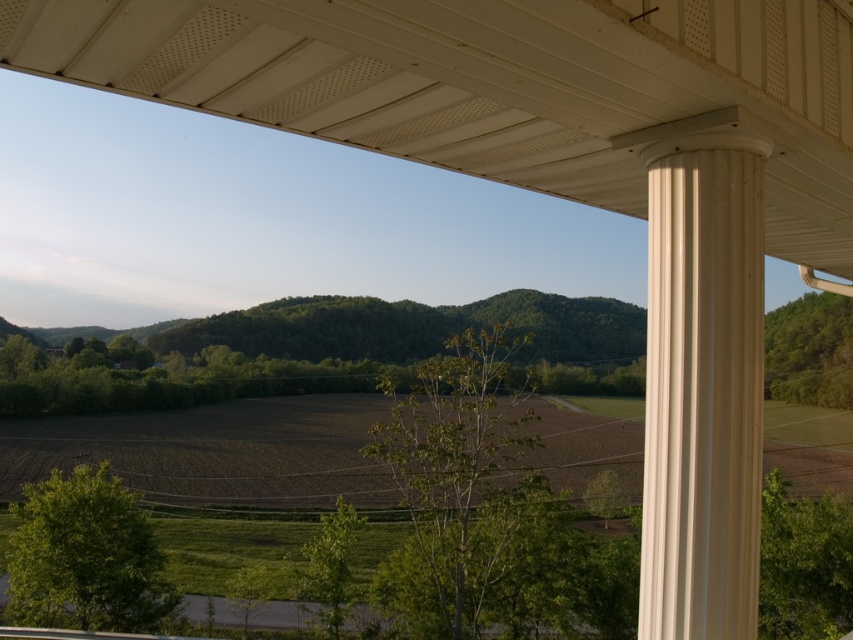
Imagine you are standing on the porch and looking out into the landscape. There are two points marked in the scene. The first point is at coordinates point (399, 134) and the second is at point (688, 580). Which point is closer to you?

Point (399, 134) is further to the camera than point (688, 580), so the point closer to you is point (688, 580).

You are standing under the porch and want to compare the sizes of the white textured ceiling at upper center and the white smooth column at right. Which one appears larger in the scene?

The white textured ceiling at upper center is bigger than the white smooth column at right, so it appears larger in the scene.

You are standing under the porch in the scene and looking out. There is a point marked at coordinates (495, 84). What does this point indicate?

The point at coordinates (495, 84) marks the white textured ceiling at upper center.